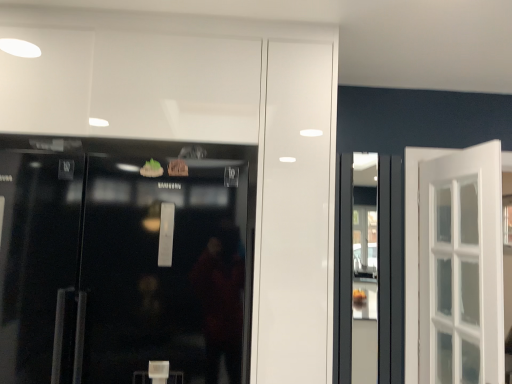
Question: Does transparent glass shop window at center have a greater height compared to black glass refrigerator at left?

Choices:
 (A) yes
 (B) no

Answer: (A)

Question: Is transparent glass shop window at center with black glass refrigerator at left?

Choices:
 (A) yes
 (B) no

Answer: (B)

Question: Considering the relative sizes of transparent glass shop window at center and black glass refrigerator at left in the image provided, is transparent glass shop window at center shorter than black glass refrigerator at left?

Choices:
 (A) yes
 (B) no

Answer: (B)

Question: From a real-world perspective, is transparent glass shop window at center positioned over black glass refrigerator at left based on gravity?

Choices:
 (A) no
 (B) yes

Answer: (A)

Question: Is transparent glass shop window at center far from black glass refrigerator at left?

Choices:
 (A) yes
 (B) no

Answer: (A)

Question: Can you confirm if transparent glass shop window at center is positioned to the right of black glass refrigerator at left?

Choices:
 (A) no
 (B) yes

Answer: (B)

Question: Is the surface of black glass refrigerator at left in direct contact with transparent glass shop window at center?

Choices:
 (A) yes
 (B) no

Answer: (B)

Question: Is black glass refrigerator at left thinner than transparent glass shop window at center?

Choices:
 (A) yes
 (B) no

Answer: (B)

Question: Does black glass refrigerator at left lie behind transparent glass shop window at center?

Choices:
 (A) no
 (B) yes

Answer: (A)

Question: Can you confirm if black glass refrigerator at left is wider than transparent glass shop window at center?

Choices:
 (A) no
 (B) yes

Answer: (B)

Question: Does black glass refrigerator at left appear on the right side of transparent glass shop window at center?

Choices:
 (A) no
 (B) yes

Answer: (A)

Question: Does black glass refrigerator at left have a greater height compared to transparent glass shop window at center?

Choices:
 (A) yes
 (B) no

Answer: (B)

Question: From a real-world perspective, is transparent glass shop window at center positioned above or below black glass refrigerator at left?

Choices:
 (A) above
 (B) below

Answer: (B)